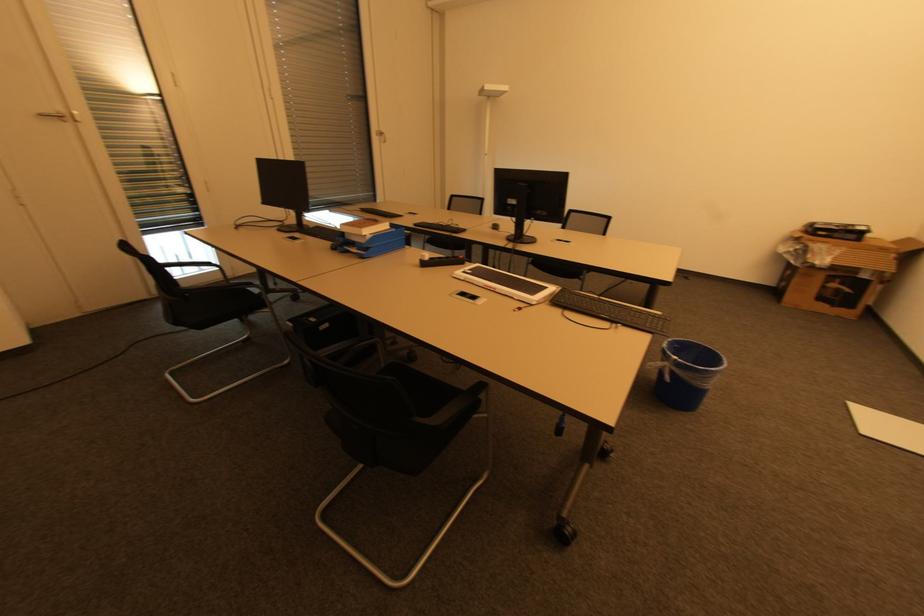
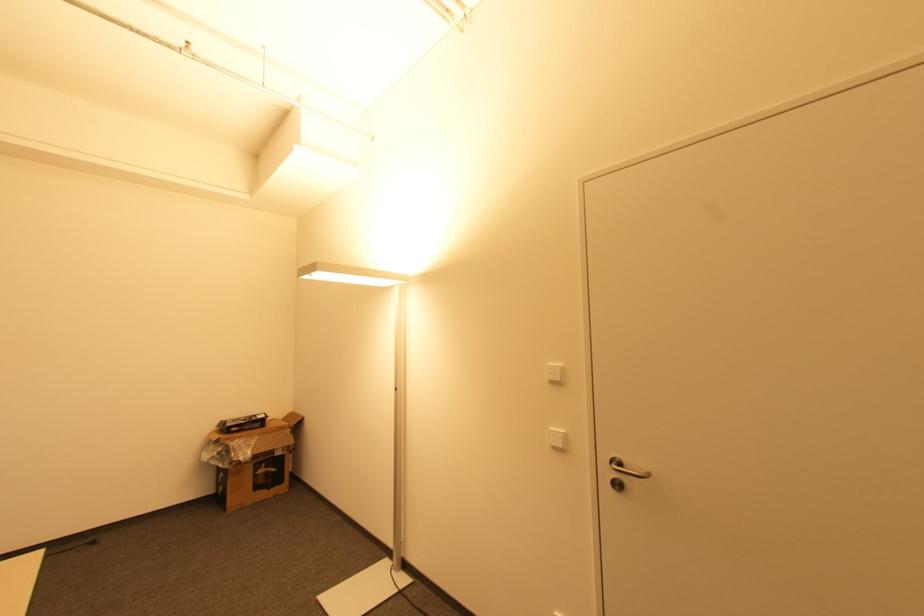
Question: I am providing you with two images of the same scene from different viewpoints. Which of the following objects are not visible in image2?

Choices:
 (A) white light switch
 (B) silver door handle
 (C) cardboard box
 (D) none of these

Answer: (D)